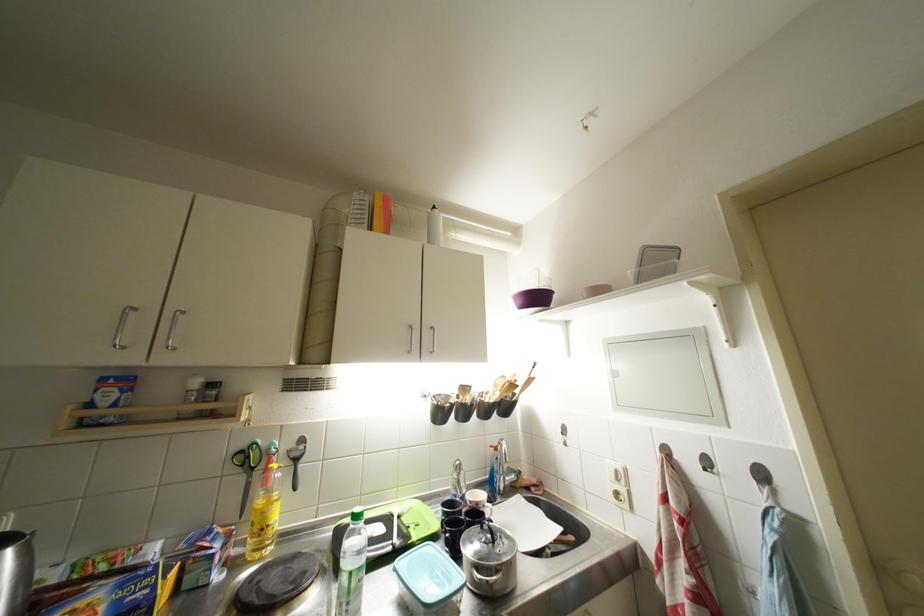
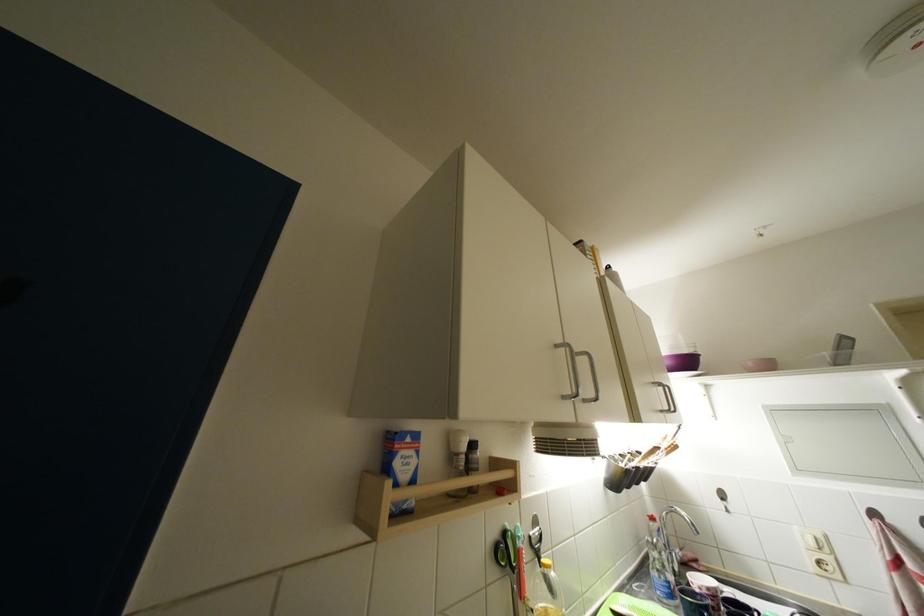
Where in the second image is the point corresponding to (x=195, y=395) from the first image?

(464, 458)